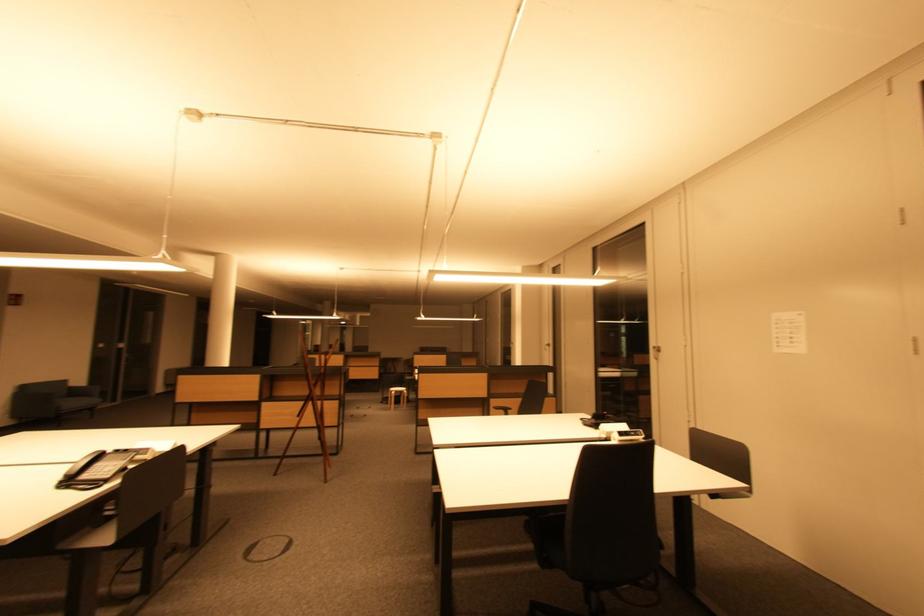
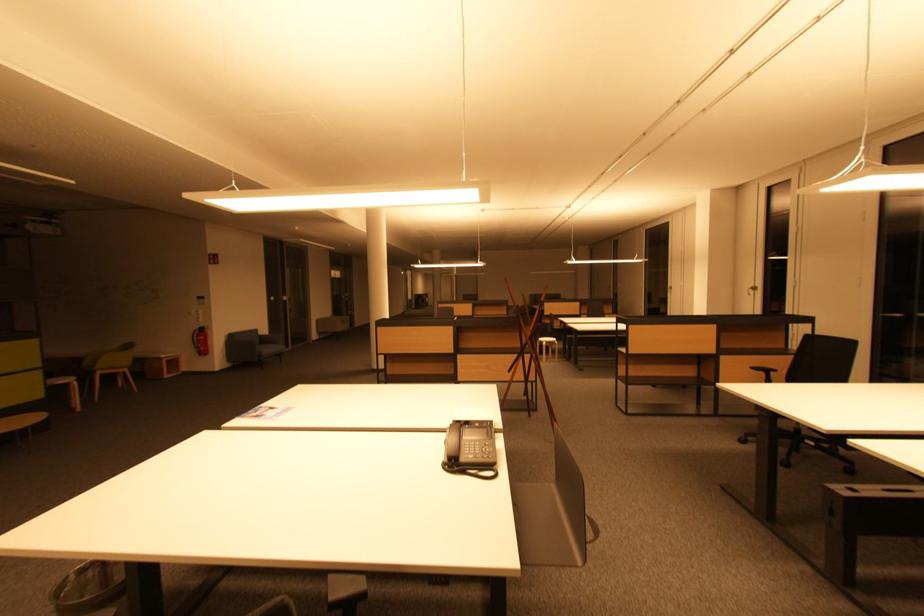
The point at (28,390) is marked in the first image. Where is the corresponding point in the second image?

(236, 339)